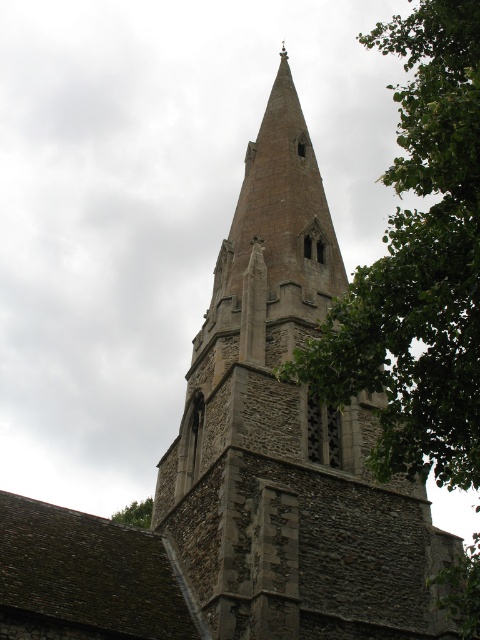
Does green leafy tree at upper right appear over green leafy tree at lower left?

Yes.

Who is higher up, green leafy tree at upper right or green leafy tree at lower left?

Positioned higher is green leafy tree at upper right.

Which is in front, point (427, 220) or point (147, 518)?

Positioned in front is point (427, 220).

Find the location of a particular element. The height and width of the screenshot is (640, 480). green leafy tree at upper right is located at coordinates (419, 266).